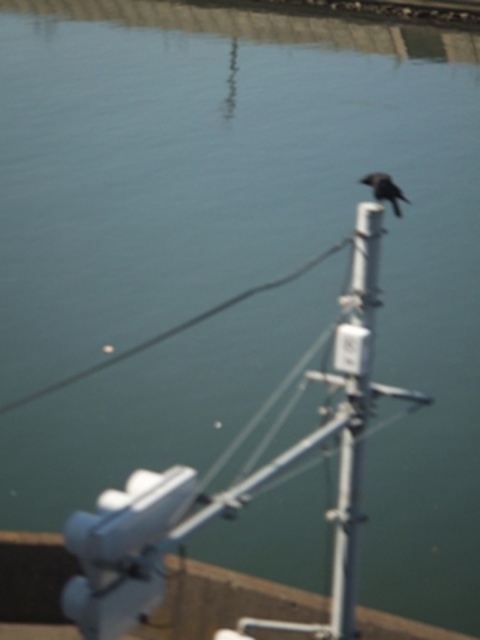
Question: Which of the following is the closest to the observer?

Choices:
 (A) (370, 182)
 (B) (312, 264)

Answer: (A)

Question: Which of the following is the closest to the observer?

Choices:
 (A) black matte bird at upper right
 (B) metallic gray telegraph pole at center
 (C) black wire at center

Answer: (A)

Question: Which point is closer to the camera?

Choices:
 (A) (375, 195)
 (B) (357, 262)
 (C) (303, 268)

Answer: (A)

Question: Does metallic gray telegraph pole at center lie behind black wire at center?

Choices:
 (A) no
 (B) yes

Answer: (A)

Question: Is metallic gray telegraph pole at center positioned before black matte bird at upper right?

Choices:
 (A) no
 (B) yes

Answer: (A)

Question: Is black wire at center further to the viewer compared to black matte bird at upper right?

Choices:
 (A) yes
 (B) no

Answer: (A)